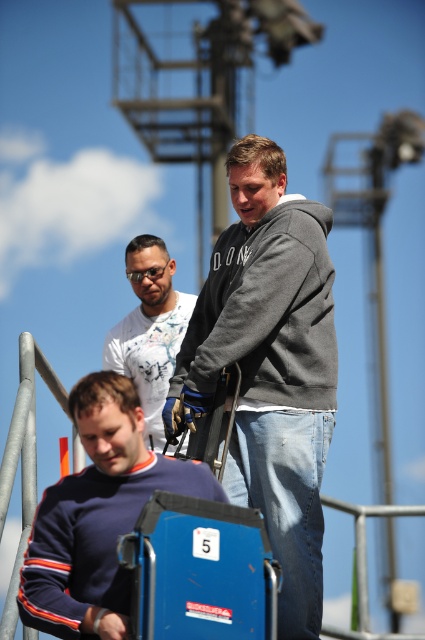
Question: Estimate the real-world distances between objects in this image. Which object is closer to the blue plastic lift at lower center?

Choices:
 (A) gray cotton hoodie at center
 (B) white printed t-shirt at center
 (C) gray hoodie at center
 (D) navy blue sweater at lower left

Answer: (D)

Question: Considering the real-world distances, which object is closest to the navy blue sweater at lower left?

Choices:
 (A) white printed t-shirt at center
 (B) gray hoodie at center
 (C) blue plastic lift at lower center
 (D) gray cotton hoodie at center

Answer: (C)

Question: Does blue plastic lift at lower center have a smaller size compared to white printed t-shirt at center?

Choices:
 (A) yes
 (B) no

Answer: (A)

Question: Which point is closer to the camera taking this photo?

Choices:
 (A) (299, 333)
 (B) (116, 346)
 (C) (85, 536)
 (D) (243, 419)

Answer: (C)

Question: Can you confirm if blue plastic lift at lower center is wider than white printed t-shirt at center?

Choices:
 (A) no
 (B) yes

Answer: (A)

Question: Can you confirm if navy blue sweater at lower left is positioned to the left of blue plastic lift at lower center?

Choices:
 (A) no
 (B) yes

Answer: (B)